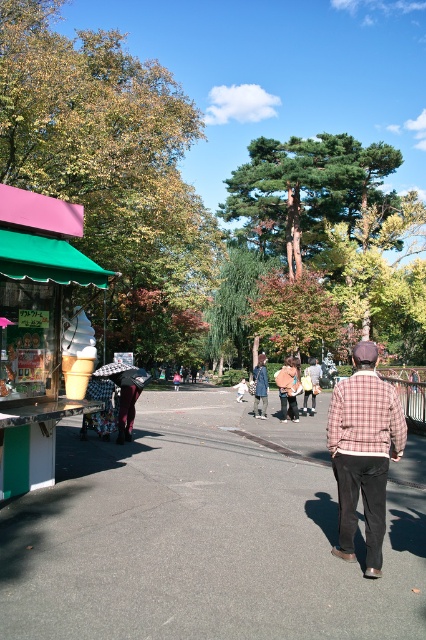
Question: Does autumn leaves at center have a greater width compared to plastic umbrella at left?

Choices:
 (A) yes
 (B) no

Answer: (A)

Question: Which object is positioned closest to the plaid shirt at center?

Choices:
 (A) green leafy tree at upper left
 (B) plaid fabric jacket at center

Answer: (B)

Question: Observing the image, what is the correct spatial positioning of plaid fabric jacket at center in reference to fluffy beige coat at center?

Choices:
 (A) below
 (B) above

Answer: (B)

Question: Which point is closer to the camera?

Choices:
 (A) denim jacket at center
 (B) plaid shirt at center
 (C) autumn leaves at center
 (D) fluffy beige coat at center

Answer: (D)

Question: Among these points, which one is farthest from the camera?

Choices:
 (A) (0, 67)
 (B) (264, 374)

Answer: (A)

Question: Where is green leafy tree at upper left located in relation to plaid fabric jacket at center in the image?

Choices:
 (A) right
 (B) left

Answer: (B)